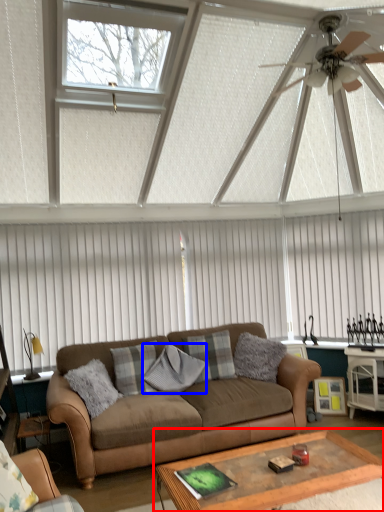
Question: Which object is closer to the camera taking this photo, coffee table (highlighted by a red box) or pillow (highlighted by a blue box)?

Choices:
 (A) coffee table
 (B) pillow

Answer: (A)